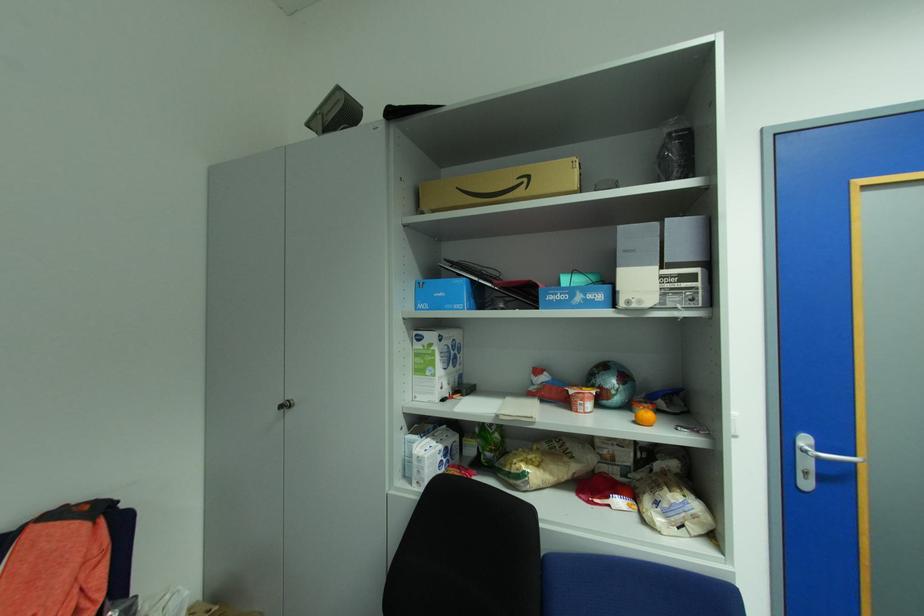
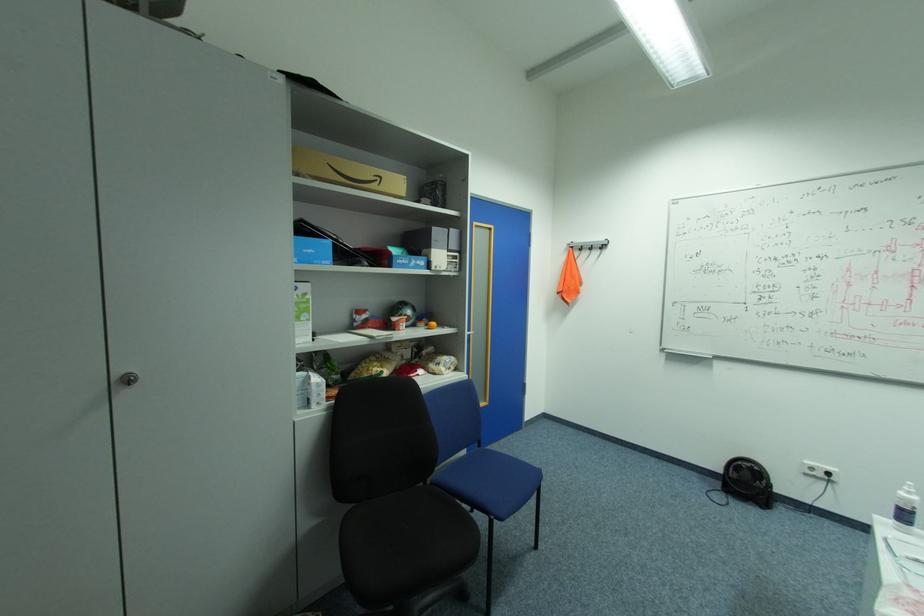
Locate, in the second image, the point that corresponds to (463,306) in the first image.

(331, 262)